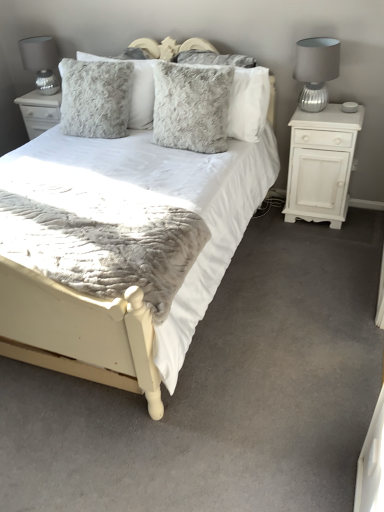
Locate an element on the screen. free space above white matte cabinet at right (from a real-world perspective) is located at coordinates (327, 108).